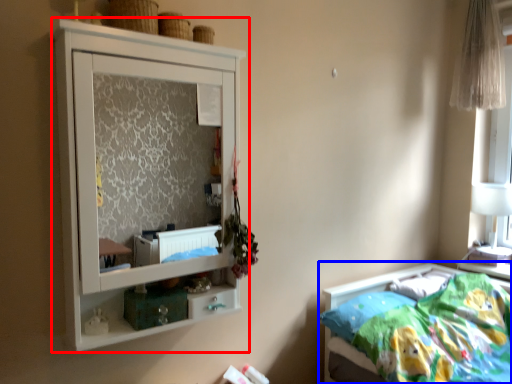
Question: Which object appears closest to the camera in this image, cupboard (highlighted by a red box) or bed (highlighted by a blue box)?

Choices:
 (A) cupboard
 (B) bed

Answer: (A)